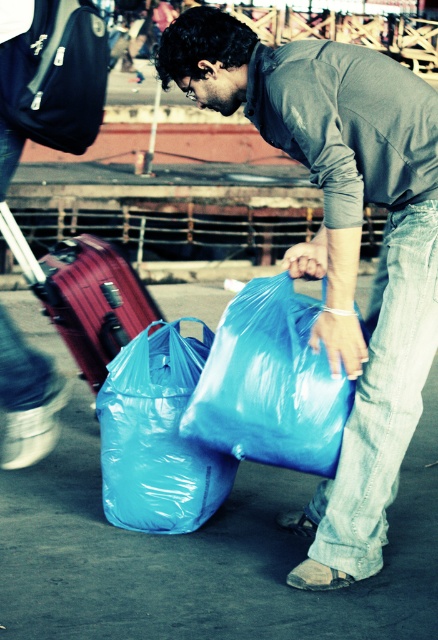
Can you confirm if matte blue plastic bag at center is positioned to the left of jeans at lower right?

No, matte blue plastic bag at center is not to the left of jeans at lower right.

Does matte blue plastic bag at center appear under jeans at lower right?

Incorrect, matte blue plastic bag at center is not positioned below jeans at lower right.

The height and width of the screenshot is (640, 438). I want to click on matte blue plastic bag at center, so click(x=341, y=246).

Where is `matte blue plastic bag at center`? The image size is (438, 640). matte blue plastic bag at center is located at coordinates (341, 246).

Which is more to the left, blue plastic bag at center or translucent blue plastic bag at lower center?

translucent blue plastic bag at lower center is more to the left.

The height and width of the screenshot is (640, 438). Describe the element at coordinates (271, 384) in the screenshot. I see `blue plastic bag at center` at that location.

Locate an element on the screen. This screenshot has height=640, width=438. blue plastic bag at center is located at coordinates (271, 384).

Which is more to the right, jeans at lower right or translucent blue plastic bag at lower center?

From the viewer's perspective, jeans at lower right appears more on the right side.

Who is more distant from viewer, (427, 268) or (161, 408)?

Positioned behind is point (161, 408).

Describe the element at coordinates (382, 397) in the screenshot. The height and width of the screenshot is (640, 438). I see `jeans at lower right` at that location.

Locate an element on the screen. This screenshot has height=640, width=438. jeans at lower right is located at coordinates (382, 397).